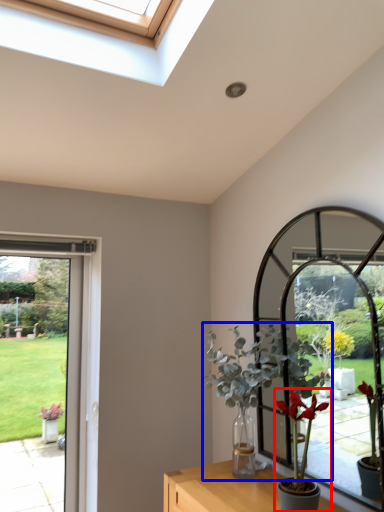
Question: Which point is closer to the camera, houseplant (highlighted by a red box) or houseplant (highlighted by a blue box)?

Choices:
 (A) houseplant
 (B) houseplant

Answer: (A)